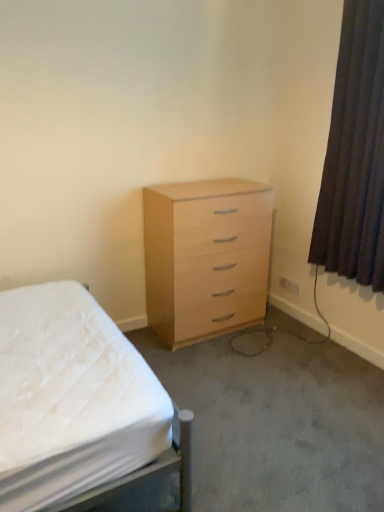
Question: Is white fabric bed at center inside or outside of dark brown fabric curtain at right?

Choices:
 (A) inside
 (B) outside

Answer: (B)

Question: From a real-world perspective, is white fabric bed at center positioned above or below dark brown fabric curtain at right?

Choices:
 (A) above
 (B) below

Answer: (B)

Question: Based on their relative distances, which object is nearer to the white fabric bed at center?

Choices:
 (A) light wood/veneer chest of drawers at center
 (B) dark brown fabric curtain at right

Answer: (A)

Question: Which object is the closest to the light wood/veneer chest of drawers at center?

Choices:
 (A) white fabric bed at center
 (B) dark brown fabric curtain at right

Answer: (B)